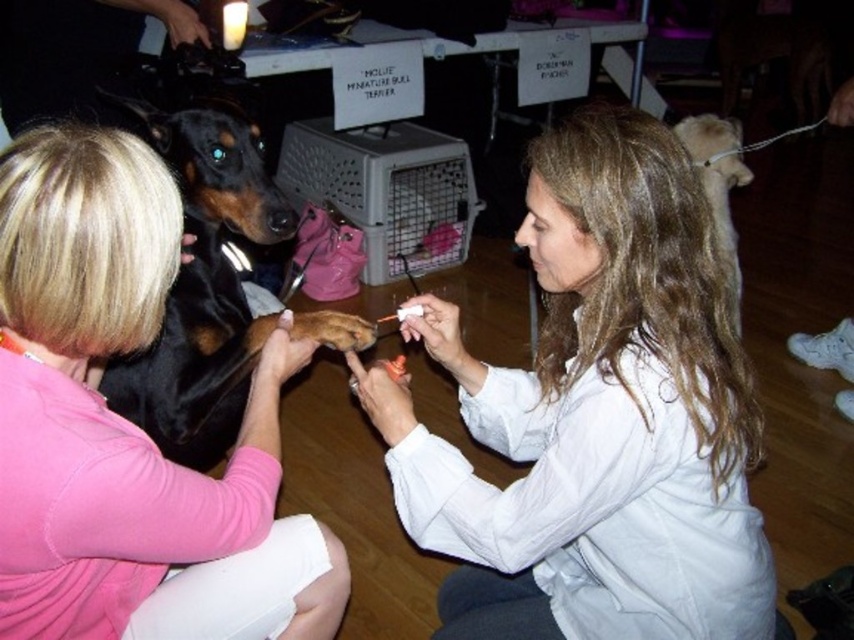
Question: Which point is farther from the camera taking this photo?

Choices:
 (A) [x=165, y=435]
 (B) [x=402, y=464]
 (C) [x=705, y=168]

Answer: (C)

Question: Is pink fabric shirt at upper left bigger than black shiny fur at center?

Choices:
 (A) yes
 (B) no

Answer: (B)

Question: Can you confirm if black shiny fur at center is positioned above light brown fur at right?

Choices:
 (A) yes
 (B) no

Answer: (B)

Question: Among these objects, which one is farthest from the camera?

Choices:
 (A) black shiny fur at center
 (B) light brown fur at right

Answer: (A)

Question: Is the position of smooth white coat at center more distant than that of light brown fur at right?

Choices:
 (A) no
 (B) yes

Answer: (A)

Question: Which of the following is the closest to the observer?

Choices:
 (A) pyautogui.click(x=161, y=147)
 (B) pyautogui.click(x=108, y=307)
 (C) pyautogui.click(x=396, y=442)
 (D) pyautogui.click(x=695, y=147)

Answer: (B)